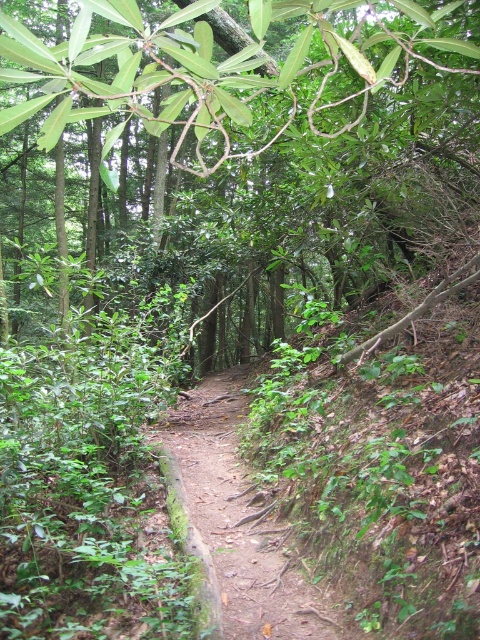
Question: Which object appears closest to the camera in this image?

Choices:
 (A) dirt path at center
 (B) green leafy tree at center

Answer: (B)

Question: Is green leafy tree at center above dirt path at center?

Choices:
 (A) yes
 (B) no

Answer: (A)

Question: Can you confirm if green leafy tree at center is wider than dirt path at center?

Choices:
 (A) no
 (B) yes

Answer: (B)

Question: From the image, what is the correct spatial relationship of green leafy tree at center in relation to dirt path at center?

Choices:
 (A) above
 (B) below

Answer: (A)

Question: Which point is farther to the camera?

Choices:
 (A) (294, 637)
 (B) (51, 116)

Answer: (A)